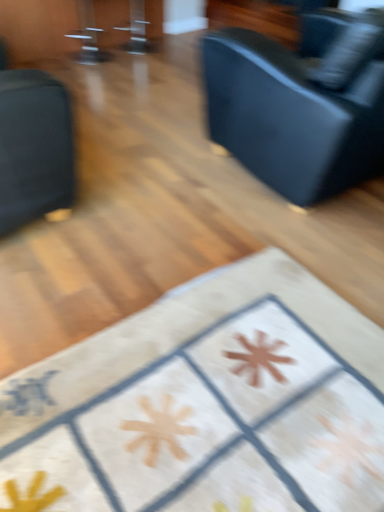
Question: Is matte black couch at left, the second furniture when ordered from bottom to top, facing away from black leather couch at upper right?

Choices:
 (A) no
 (B) yes

Answer: (A)

Question: Is matte black couch at left, marked as the 1th furniture in a left-to-right arrangement, not within black leather couch at upper right?

Choices:
 (A) yes
 (B) no

Answer: (A)

Question: From a real-world perspective, is matte black couch at left, marked as the 1th furniture in a left-to-right arrangement, positioned under black leather couch at upper right based on gravity?

Choices:
 (A) yes
 (B) no

Answer: (A)

Question: Considering the relative positions of matte black couch at left, the second furniture in the right-to-left sequence, and black leather couch at upper right in the image provided, is matte black couch at left, the second furniture in the right-to-left sequence, to the left of black leather couch at upper right from the viewer's perspective?

Choices:
 (A) yes
 (B) no

Answer: (A)

Question: Considering the relative sizes of matte black couch at left, the second furniture when ordered from bottom to top, and black leather couch at upper right in the image provided, is matte black couch at left, the second furniture when ordered from bottom to top, shorter than black leather couch at upper right?

Choices:
 (A) no
 (B) yes

Answer: (B)

Question: Is matte black couch at left, the second furniture when ordered from bottom to top, further to the viewer compared to black leather couch at upper right?

Choices:
 (A) yes
 (B) no

Answer: (B)

Question: Is black leather couch at upper right not within matte black couch at left, placed as the first furniture when sorted from top to bottom?

Choices:
 (A) yes
 (B) no

Answer: (A)

Question: Does black leather couch at upper right appear on the left side of matte black couch at left, placed as the first furniture when sorted from top to bottom?

Choices:
 (A) no
 (B) yes

Answer: (A)

Question: Is the surface of black leather couch at upper right in direct contact with matte black couch at left, the second furniture in the right-to-left sequence?

Choices:
 (A) no
 (B) yes

Answer: (A)

Question: From the image's perspective, is black leather couch at upper right over matte black couch at left, the second furniture when ordered from bottom to top?

Choices:
 (A) no
 (B) yes

Answer: (B)

Question: Considering the relative positions of black leather couch at upper right and matte black couch at left, the second furniture in the right-to-left sequence, in the image provided, is black leather couch at upper right in front of matte black couch at left, the second furniture in the right-to-left sequence,?

Choices:
 (A) no
 (B) yes

Answer: (A)

Question: Considering the relative sizes of black leather couch at upper right and matte black couch at left, the second furniture when ordered from bottom to top, in the image provided, is black leather couch at upper right taller than matte black couch at left, the second furniture when ordered from bottom to top,?

Choices:
 (A) no
 (B) yes

Answer: (B)

Question: Is white fabric rug at center, which ranks as the second furniture in top-to-bottom order, thinner than black leather couch at upper right?

Choices:
 (A) no
 (B) yes

Answer: (B)